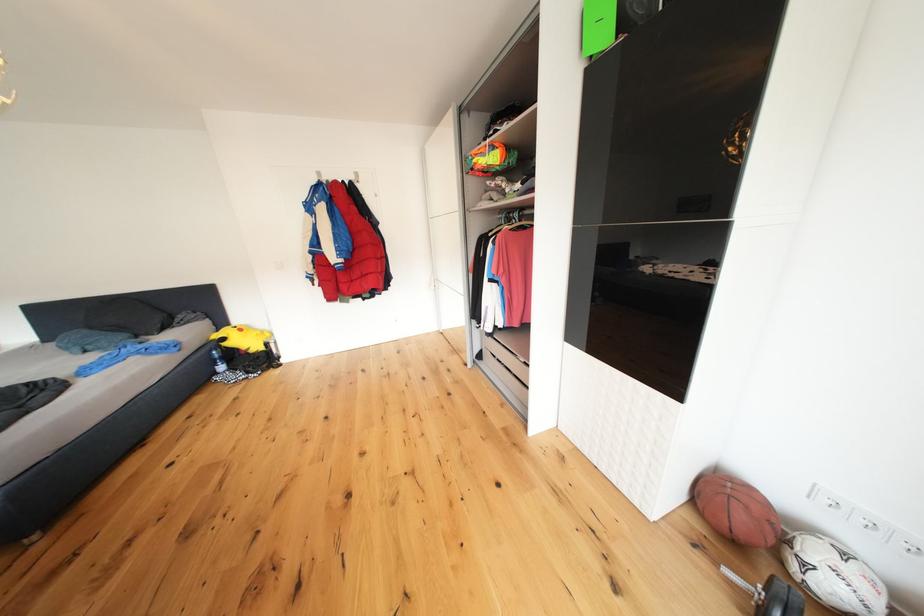
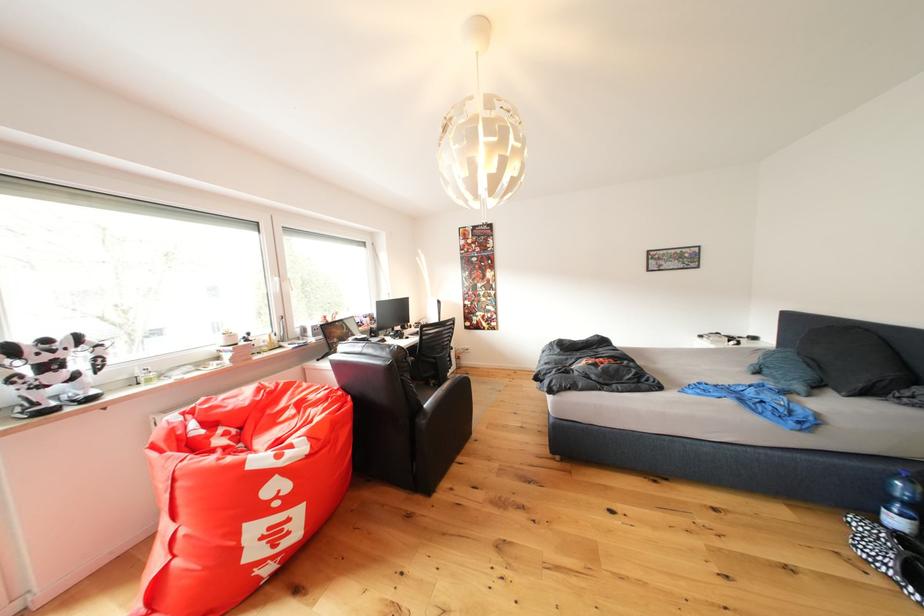
Where in the second image is the point corresponding to (x=232, y=373) from the first image?

(906, 527)